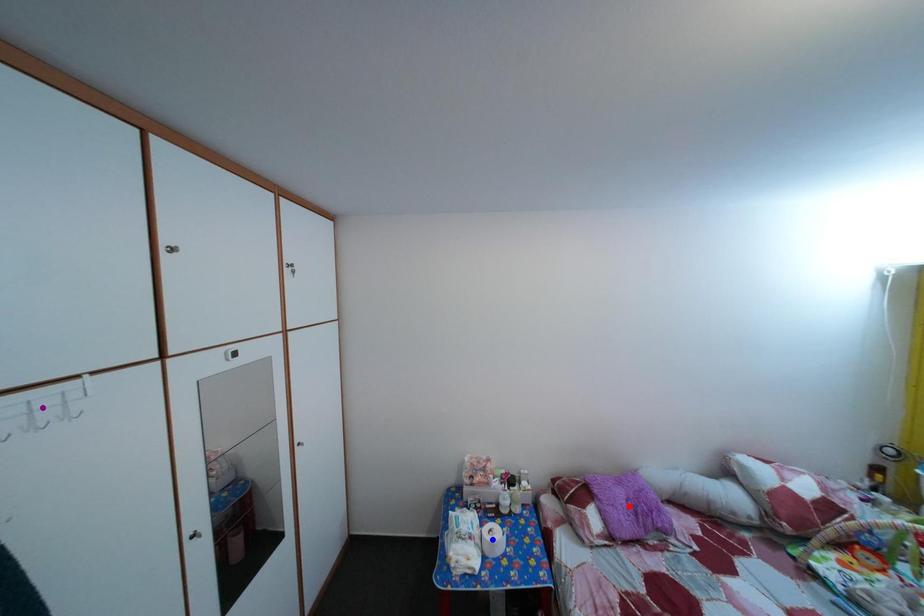
Order these from nearest to farthest:
A) blue point
B) red point
C) purple point

purple point
red point
blue point